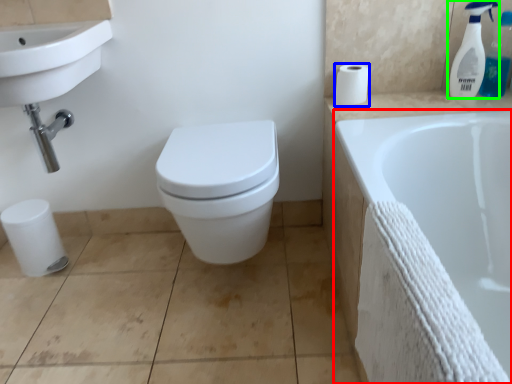
Question: Which is nearer to the bathtub (highlighted by a red box)? toilet paper (highlighted by a blue box) or cleaning product (highlighted by a green box).

Choices:
 (A) toilet paper
 (B) cleaning product

Answer: (A)